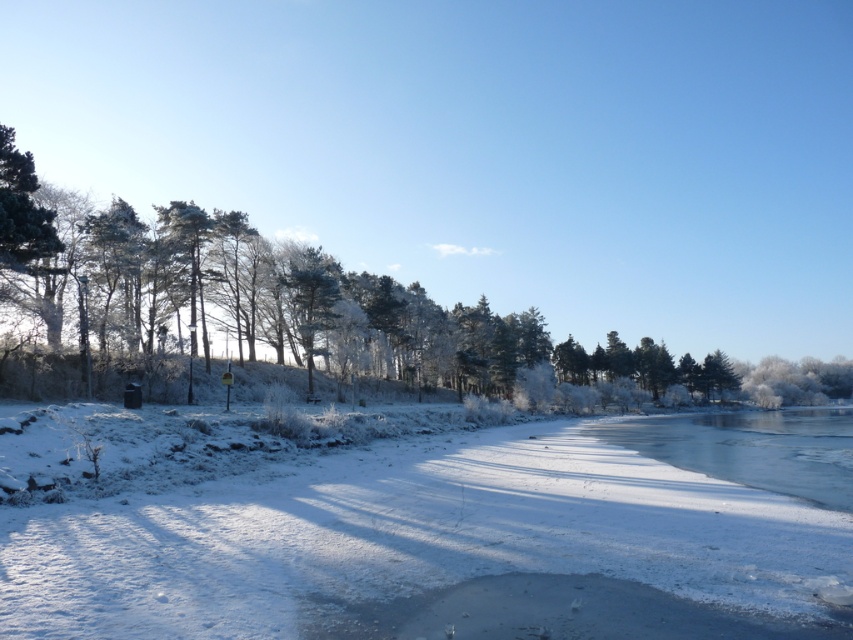
You are a hiker planning to cross the clear ice water at lower right. There is a white frosty snow at center nearby. Which surface would you step on first according to the scene?

The white frosty snow at center is located above the clear ice water at lower right, so you would step on the white frosty snow at center first.

You are standing in the winter landscape and want to walk from the point closer to you to the point further away. Which path would you take between the two points, point (815, 509) and point (744, 429)?

You should walk from point (815, 509) to point (744, 429) because point (815, 509) is closer to the viewer and the other point is further away.